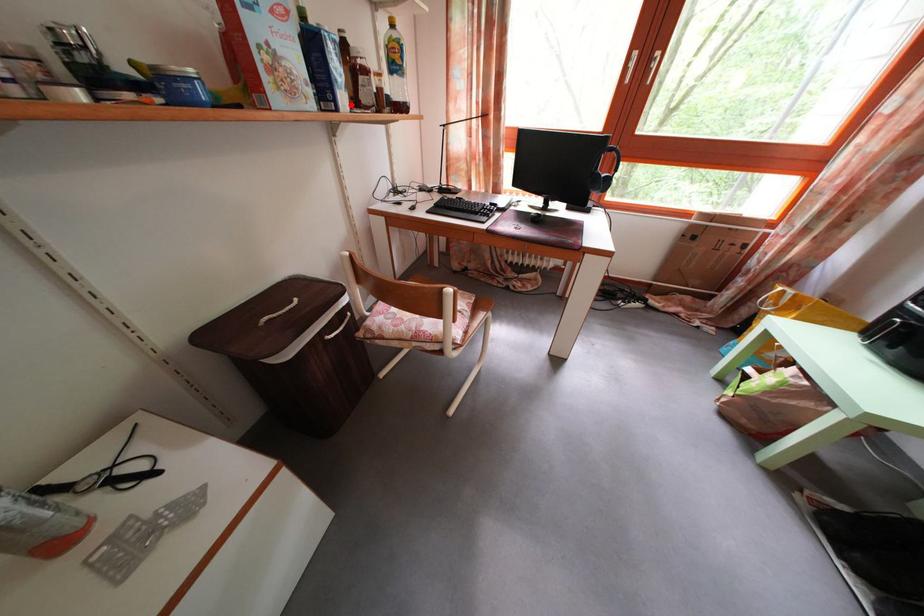
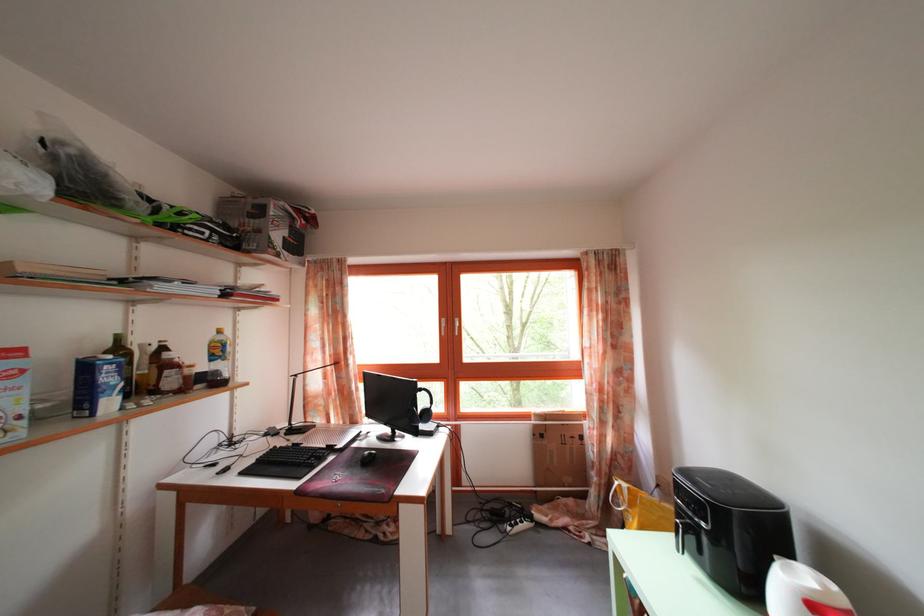
Find the pixel in the second image that matches the highlighted location in the first image.

(117, 410)